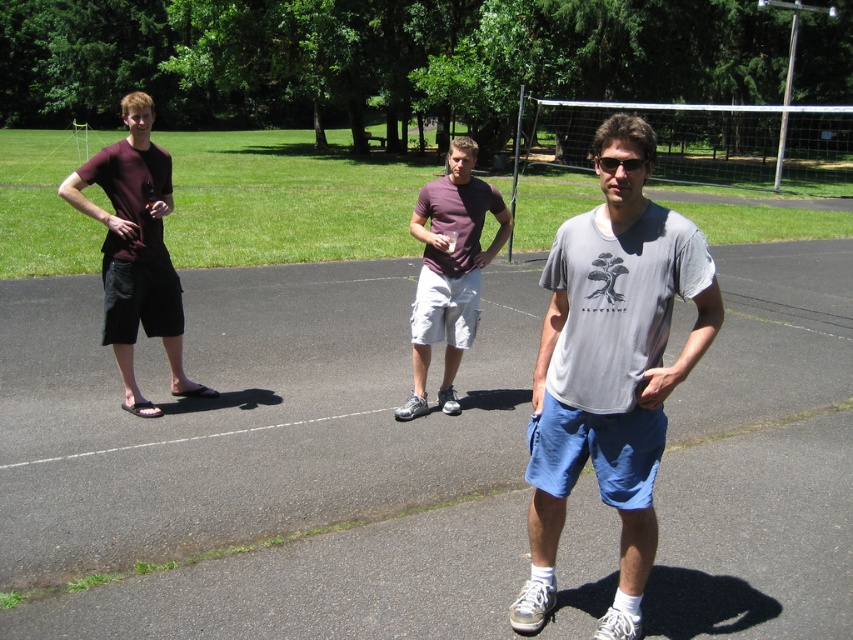
Can you confirm if matte black shorts at left is positioned above purple cotton t-shirt at center?

No.

Is matte black shorts at left thinner than purple cotton t-shirt at center?

In fact, matte black shorts at left might be wider than purple cotton t-shirt at center.

Is point (177, 384) positioned in front of point (490, 209)?

No, it is behind (490, 209).

Find the location of a particular element. This screenshot has width=853, height=640. matte black shorts at left is located at coordinates (135, 250).

Does blue fabric shorts at center appear on the right side of gray cotton t-shirt at center?

No, blue fabric shorts at center is not to the right of gray cotton t-shirt at center.

Measure the distance between blue fabric shorts at center and gray cotton t-shirt at center.

blue fabric shorts at center is 9.01 feet from gray cotton t-shirt at center.

Which is in front, point (247, 456) or point (679, 280)?

Positioned in front is point (679, 280).

Identify the location of blue fabric shorts at center. This screenshot has height=640, width=853. (265, 465).

Who is more forward, (653, 451) or (167, 188)?

Point (653, 451) is more forward.

The image size is (853, 640). What do you see at coordinates (610, 369) in the screenshot?
I see `gray cotton t-shirt at center` at bounding box center [610, 369].

Where is `gray cotton t-shirt at center`? Image resolution: width=853 pixels, height=640 pixels. gray cotton t-shirt at center is located at coordinates (610, 369).